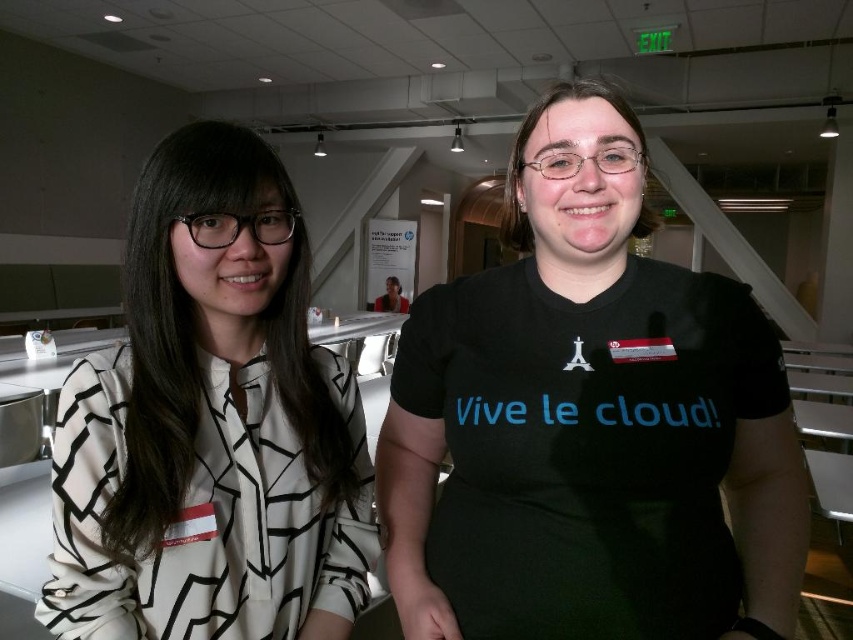
You are standing in a conference room and want to reach the point marked at coordinates point (628, 145). The space has a 30 inch wide wheelchair ramp available. Can the ramp be placed to reach that point?

The distance between the viewer and point (628, 145) is 31.09 inches, which is slightly longer than the 30 inch ramp. Therefore, the ramp may not be sufficient to reach the point unless extended or adjusted.